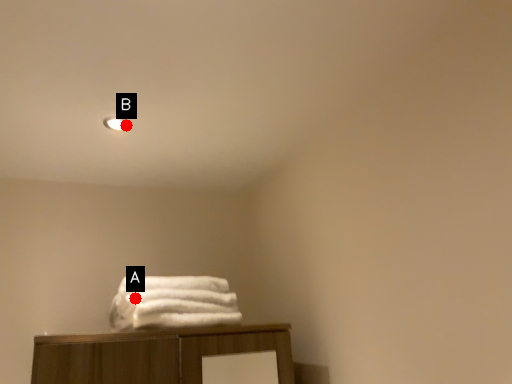
Question: Two points are circled on the image, labeled by A and B beside each circle. Which point is closer to the camera taking this photo?

Choices:
 (A) A is closer
 (B) B is closer

Answer: (A)